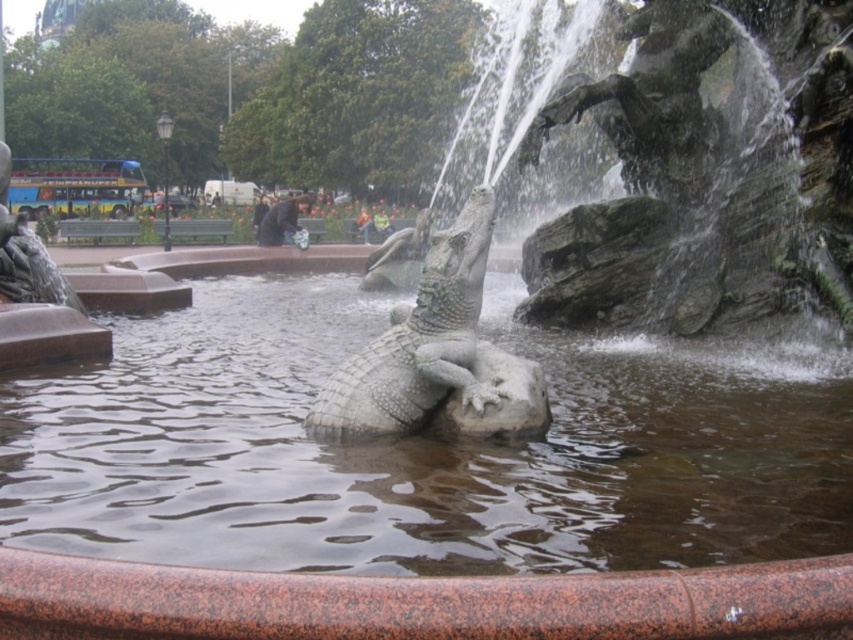
Looking at this image, you are standing at the edge of the fountain and want to place a small flowerpot between the smooth stone water at center and the polished stone crocodile at center. Based on their positions, where should you place the flowerpot?

The smooth stone water at center is located below the polished stone crocodile at center, so you should place the flowerpot between them by positioning it below the polished stone crocodile at center and above the smooth stone water at center.

You are standing at the edge of the fountain and want to place a small flower pot between the smooth stone water at center and the polished stone crocodile at center. Which object should the flower pot be closer to if you want it to be higher than the water but lower than the crocodile?

The flower pot should be placed closer to the smooth stone water at center because it has a lesser height compared to the polished stone crocodile at center, ensuring the pot is higher than the water but lower than the crocodile.